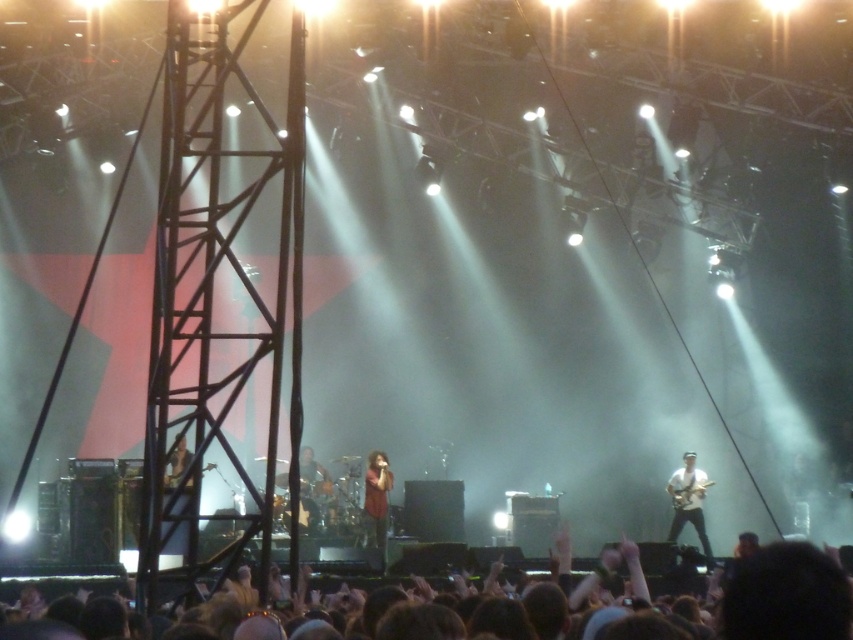
Is point (769, 600) closer to viewer compared to point (384, 506)?

Yes.

Between point (776, 545) and point (386, 509), which one is positioned behind?

The point (386, 509) is more distant.

Identify the location of brown hair at lower center. This screenshot has height=640, width=853. point(456,612).

Is white matte guitar at right positioned before metallic silver microphone at left?

No, it is not.

Who is higher up, white matte guitar at right or metallic silver microphone at left?

metallic silver microphone at left

What do you see at coordinates (688, 500) in the screenshot? The height and width of the screenshot is (640, 853). I see `white matte guitar at right` at bounding box center [688, 500].

I want to click on white matte guitar at right, so click(x=688, y=500).

Does white matte guitar at right appear under shiny black guitar at center?

No.

Where is `white matte guitar at right`? This screenshot has width=853, height=640. white matte guitar at right is located at coordinates (688, 500).